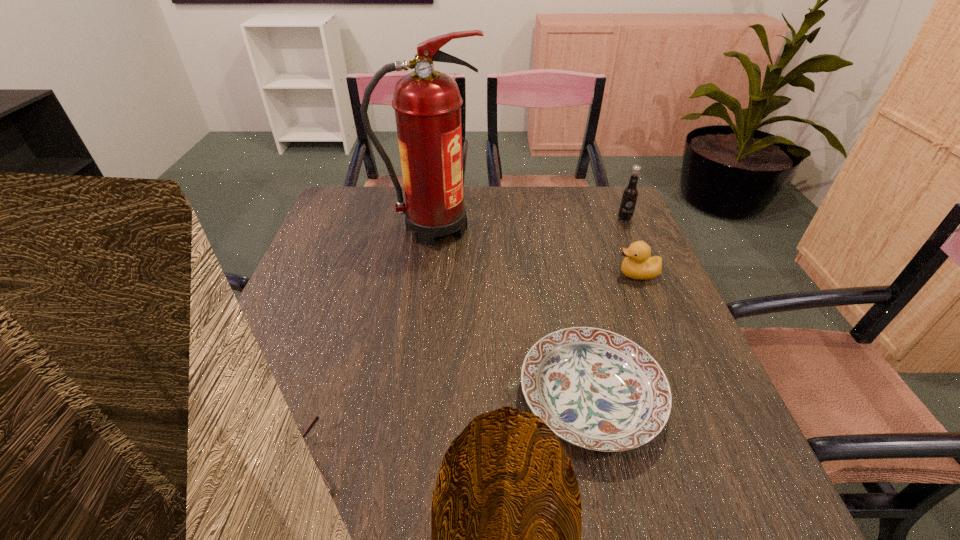
Where is `vacant space situated on the face of the duckling`? This screenshot has height=540, width=960. vacant space situated on the face of the duckling is located at coordinates (573, 274).

In order to click on vacant space positioned on the back of the plate in this screenshot , I will do `click(563, 268)`.

The image size is (960, 540). What are the coordinates of `fire extinguisher at the far edge` in the screenshot? It's located at (427, 103).

Image resolution: width=960 pixels, height=540 pixels. Identify the location of root beer that is at the far edge. point(630,194).

Locate an element on the screen. This screenshot has width=960, height=540. object situated at the near edge is located at coordinates (316, 418).

Where is `object situated at the left edge`? This screenshot has height=540, width=960. object situated at the left edge is located at coordinates (316, 418).

This screenshot has width=960, height=540. What are the coordinates of `root beer situated at the right edge` in the screenshot? It's located at (630, 194).

I want to click on duckling at the right edge, so tap(638, 265).

I want to click on plate at the right edge, so pyautogui.click(x=596, y=389).

I want to click on object at the near left corner, so click(316, 418).